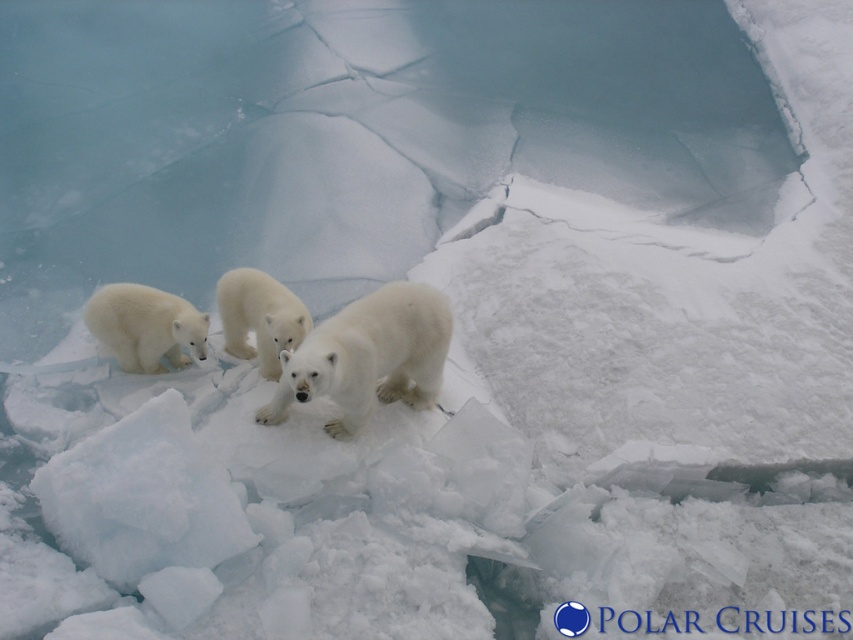
Question: Which point appears closest to the camera in this image?

Choices:
 (A) (401, 317)
 (B) (254, 307)

Answer: (A)

Question: Which point is farther to the camera?

Choices:
 (A) white fur bear at center
 (B) white fluffy bear cub at lower left

Answer: (B)

Question: Is white fluffy bear at center positioned before white fur bear at center?

Choices:
 (A) yes
 (B) no

Answer: (A)

Question: Which point appears closest to the camera in this image?

Choices:
 (A) (318, 340)
 (B) (109, 305)
 (C) (242, 320)

Answer: (A)

Question: Does white fluffy bear at center appear on the right side of white fur bear at center?

Choices:
 (A) yes
 (B) no

Answer: (A)

Question: Does white fluffy bear cub at lower left appear on the right side of white fur bear at center?

Choices:
 (A) yes
 (B) no

Answer: (B)